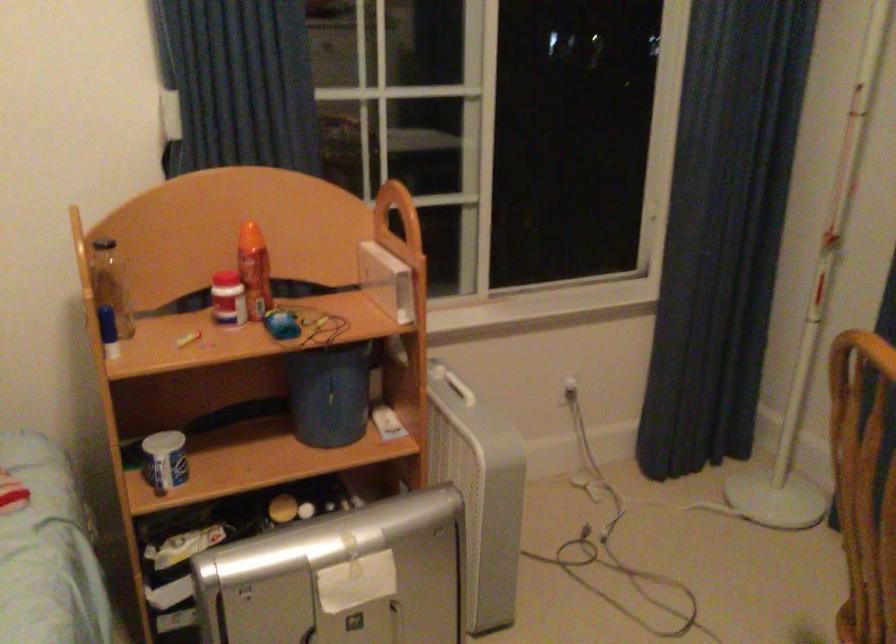
Where is `shelf side handle`? The width and height of the screenshot is (896, 644). shelf side handle is located at coordinates (864, 484).